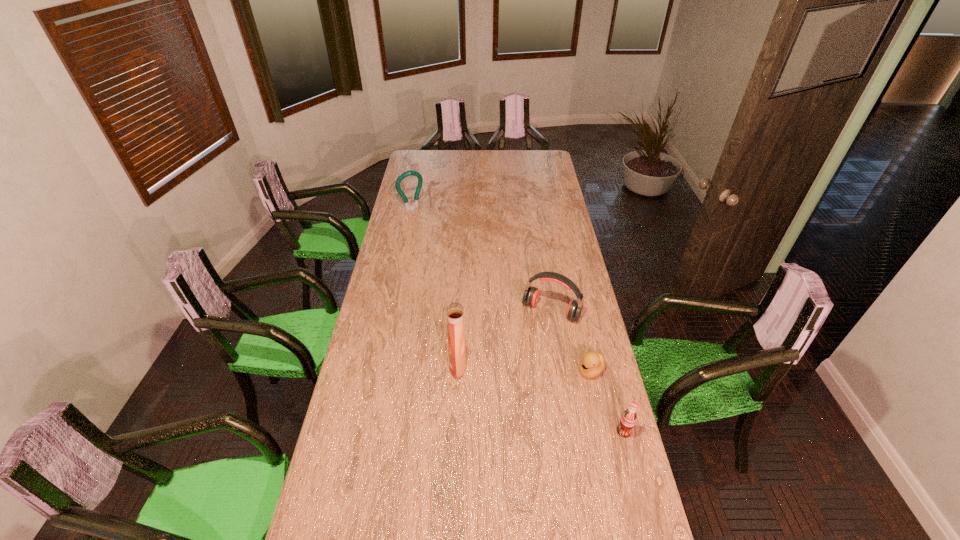
Identify the location of free area in between the second tallest object and the duckling. (501, 289).

At what (x,y) coordinates should I click in order to perform the action: click on free area in between the shortest object and the farthest object. Please return your answer as a coordinate pair (x, y). The image size is (960, 540). Looking at the image, I should click on (501, 289).

Locate an element on the screen. free area in between the soda and the detergent is located at coordinates (540, 398).

Identify the location of free point between the duckling and the tallest object. This screenshot has height=540, width=960. (524, 367).

The image size is (960, 540). I want to click on free space that is in between the detergent and the fourth nearest object, so click(x=505, y=338).

At what (x,y) coordinates should I click in order to perform the action: click on vacant space that's between the farthest object and the shortest object. Please return your answer as a coordinate pair (x, y). This screenshot has height=540, width=960. Looking at the image, I should click on (501, 289).

The height and width of the screenshot is (540, 960). Identify the location of free spot between the duckling and the fourth object from right to left. (524, 367).

Where is `object that stands as the second closest to the fourth object from right to left`? This screenshot has height=540, width=960. object that stands as the second closest to the fourth object from right to left is located at coordinates (593, 363).

You are a GUI agent. You are given a task and a screenshot of the screen. Output one action in this format:
    pyautogui.click(x=<x>, y=<y>)
    Task: Click on the object that can be found as the closest to the earphone
    The width and height of the screenshot is (960, 540).
    Given the screenshot: What is the action you would take?
    pyautogui.click(x=593, y=363)

Find the location of a particular element. The image size is (960, 540). vacant space that satisfies the following two spatial constraints: 1. on the front side of the second tallest object; 2. on the right side of the earphone is located at coordinates (391, 311).